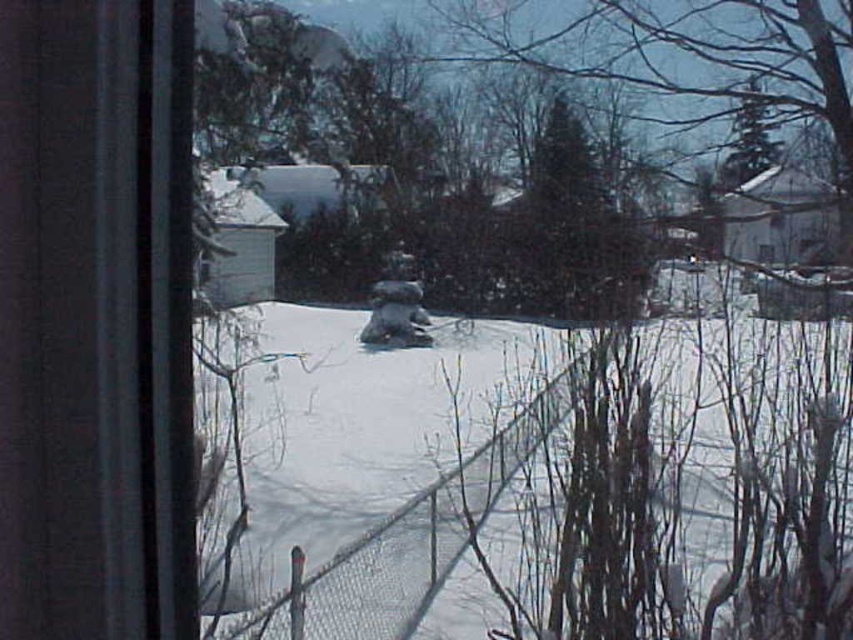
Who is more forward, (x=125, y=595) or (x=376, y=609)?

Point (x=125, y=595) is in front.

The width and height of the screenshot is (853, 640). In order to click on transparent glass window at left in this screenshot , I will do `click(96, 321)`.

Locate an element on the screen. The height and width of the screenshot is (640, 853). transparent glass window at left is located at coordinates (96, 321).